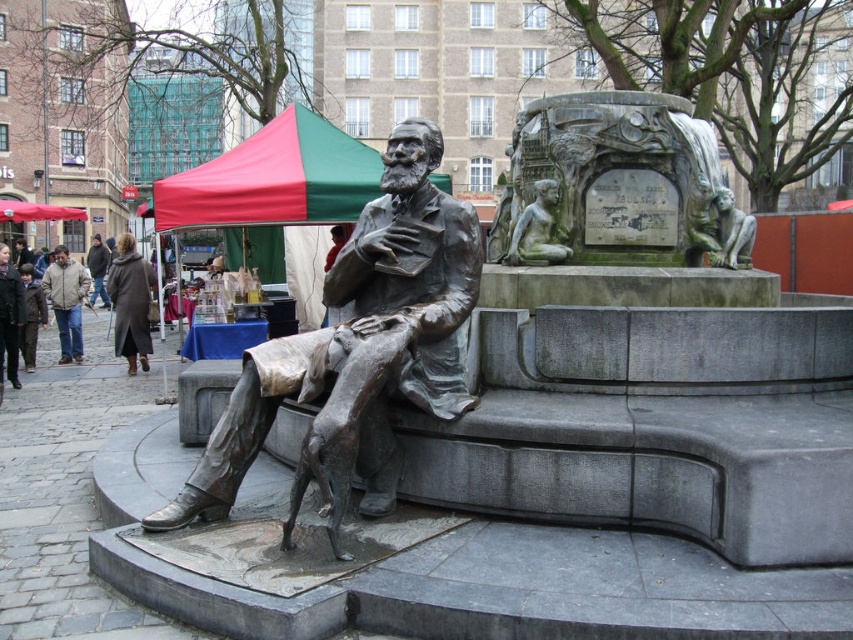
You are standing at the camera position and want to take a photo of the green patina stone monument at upper right. If your camera has a zoom lens capable of focusing on objects up to 6 meters away, will you be able to capture a clear image of the monument?

The green patina stone monument at upper right is 6.44 meters away from the camera. Since the camera can focus up to 6 meters, it cannot reach the required distance. You might need to move closer or use a longer lens.

You are an artist trying to sketch the scene. You need to decide which object to draw first based on their widths. Which one should you start with, the green stone statue at upper center or the red fabric canopy at upper left?

The red fabric canopy at upper left is wider than the green stone statue at upper center, so you should start drawing the red fabric canopy at upper left first since it takes up more space in the composition.